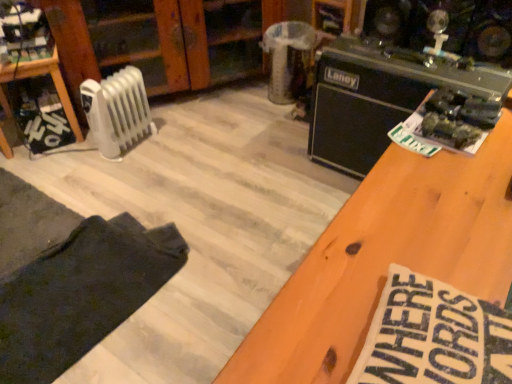
This screenshot has height=384, width=512. In order to click on dark cotton pants at lower left in this screenshot , I will do [x=81, y=294].

You are a GUI agent. You are given a task and a screenshot of the screen. Output one action in this format:
    pyautogui.click(x=<x>, y=<y>)
    Task: Click on the black matte amplifier at upper right
    
    Given the screenshot: What is the action you would take?
    click(378, 98)

Describe the element at coordinates (378, 98) in the screenshot. I see `black matte amplifier at upper right` at that location.

Where is `white plastic radiator at left`? The image size is (512, 384). white plastic radiator at left is located at coordinates (161, 40).

I want to click on dark cotton pants at lower left, so click(81, 294).

Which is farther, (387, 57) or (110, 94)?

The point (110, 94) is more distant.

From a real-world perspective, is black matte amplifier at upper right physically located above or below white plastic radiator at left?

From a real-world perspective, black matte amplifier at upper right is physically above white plastic radiator at left.

Which of these two, black matte amplifier at upper right or white plastic radiator at left, is thinner?

white plastic radiator at left is thinner.

Is black matte amplifier at upper right positioned beyond the bounds of white plastic radiator at left?

That's correct, black matte amplifier at upper right is outside of white plastic radiator at left.

Which object is further away from the camera, white plastic radiator at left or dark cotton pants at lower left?

white plastic radiator at left is further from the camera.

What's the angular difference between white plastic radiator at left and dark cotton pants at lower left's facing directions?

5.7 degrees separate the facing orientations of white plastic radiator at left and dark cotton pants at lower left.

Is white plastic radiator at left surrounding dark cotton pants at lower left?

That's incorrect, dark cotton pants at lower left is not inside white plastic radiator at left.

In the image, is wooden shelf at left positioned in front of or behind dark cotton pants at lower left?

wooden shelf at left is behind dark cotton pants at lower left.

Does wooden shelf at left have a greater height compared to dark cotton pants at lower left?

Yes, wooden shelf at left is taller than dark cotton pants at lower left.

Does wooden shelf at left turn towards dark cotton pants at lower left?

Yes, wooden shelf at left is oriented towards dark cotton pants at lower left.

In terms of size, does wooden shelf at left appear bigger or smaller than black matte amplifier at upper right?

wooden shelf at left is smaller than black matte amplifier at upper right.

Is black matte amplifier at upper right completely or partially inside wooden shelf at left?

No, black matte amplifier at upper right is located outside of wooden shelf at left.

Is the position of wooden shelf at left less distant than that of black matte amplifier at upper right?

No.

From their relative heights in the image, would you say wooden shelf at left is taller or shorter than black matte amplifier at upper right?

In the image, wooden shelf at left appears to be shorter than black matte amplifier at upper right.

Is point (175, 5) less distant than point (2, 66)?

No, it is not.

From a real-world perspective, which object stands above the other?

From a 3D spatial view, white plastic radiator at left is above.

Is white plastic radiator at left thinner than wooden shelf at left?

Incorrect, the width of white plastic radiator at left is not less than that of wooden shelf at left.

Who is more distant, white plastic radiator at left or wooden shelf at left?

white plastic radiator at left is further away from the camera.

Is white plastic radiator at left located within black matte amplifier at upper right?

No, black matte amplifier at upper right does not contain white plastic radiator at left.

Looking at their sizes, would you say black matte amplifier at upper right is wider or thinner than white plastic radiator at left?

Clearly, black matte amplifier at upper right has less width compared to white plastic radiator at left.

From the image's perspective, is black matte amplifier at upper right positioned above or below white plastic radiator at left?

black matte amplifier at upper right is below white plastic radiator at left.

Does black matte amplifier at upper right appear on the left side of white plastic radiator at left?

No, black matte amplifier at upper right is not to the left of white plastic radiator at left.

Considering the sizes of objects black matte amplifier at upper right and wooden shelf at left in the image provided, who is taller, black matte amplifier at upper right or wooden shelf at left?

With more height is black matte amplifier at upper right.

Locate an element on the screen. This screenshot has width=512, height=384. furniture that is on the left side of black matte amplifier at upper right is located at coordinates (38, 75).

Which object is further away from the camera, black matte amplifier at upper right or wooden shelf at left?

wooden shelf at left is more distant.

From the image's perspective, which one is positioned higher, black matte amplifier at upper right or wooden shelf at left?

wooden shelf at left, from the image's perspective.

Locate an element on the screen. The image size is (512, 384). appliance that is on the right side of white plastic radiator at left is located at coordinates (378, 98).

The width and height of the screenshot is (512, 384). What are the coordinates of `clothing below the white plastic radiator at left (from a real-world perspective)` in the screenshot? It's located at (81, 294).

Considering their positions, is black matte amplifier at upper right positioned closer to white plastic radiator at left than white plastic radiator at left?

white plastic radiator at left is positioned closer to the anchor white plastic radiator at left.

Based on their spatial positions, is dark cotton pants at lower left or black matte amplifier at upper right further from white plastic radiator at left?

dark cotton pants at lower left.

From the image, which object appears to be farther from white plastic radiator at left, wooden shelf at left or white plastic radiator at left?

The object further to white plastic radiator at left is white plastic radiator at left.

Estimate the real-world distances between objects in this image. Which object is closer to white plastic radiator at left, black matte amplifier at upper right or dark cotton pants at lower left?

black matte amplifier at upper right is closer to white plastic radiator at left.

Which object lies nearer to the anchor point wooden shelf at left, black matte amplifier at upper right or white plastic radiator at left?

white plastic radiator at left lies closer to wooden shelf at left than the other object.

Estimate the real-world distances between objects in this image. Which object is further from black matte amplifier at upper right, wooden shelf at left or white plastic radiator at left?

wooden shelf at left is positioned further to the anchor black matte amplifier at upper right.

Based on their spatial positions, is dark cotton pants at lower left or black matte amplifier at upper right further from wooden shelf at left?

The object further to wooden shelf at left is black matte amplifier at upper right.

Which object lies further to the anchor point wooden shelf at left, white plastic radiator at left or black matte amplifier at upper right?

black matte amplifier at upper right lies further to wooden shelf at left than the other object.

Where is `radiator between wooden shelf at left and dark cotton pants at lower left in the up-down direction`? The image size is (512, 384). radiator between wooden shelf at left and dark cotton pants at lower left in the up-down direction is located at coordinates (117, 111).

At what (x,y) coordinates should I click in order to perform the action: click on clothing between wooden shelf at left and black matte amplifier at upper right. Please return your answer as a coordinate pair (x, y). The width and height of the screenshot is (512, 384). Looking at the image, I should click on (81, 294).

I want to click on radiator between white plastic radiator at left and dark cotton pants at lower left in the vertical direction, so click(x=117, y=111).

The width and height of the screenshot is (512, 384). I want to click on clothing between white plastic radiator at left and black matte amplifier at upper right from left to right, so click(x=81, y=294).